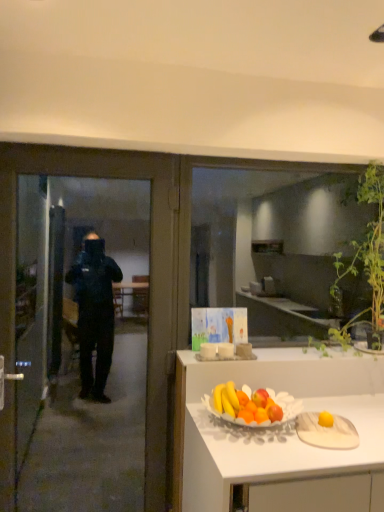
Question: Visually, is green leafy plant at upper right positioned to the left or to the right of transparent glass window at center?

Choices:
 (A) right
 (B) left

Answer: (A)

Question: From a real-world perspective, is green leafy plant at upper right physically located above or below transparent glass window at center?

Choices:
 (A) above
 (B) below

Answer: (B)

Question: Which object is positioned closest to the transparent glass window at center?

Choices:
 (A) transparent glass door at left
 (B) green leafy plant at upper right

Answer: (B)

Question: Which object is positioned closest to the green leafy plant at upper right?

Choices:
 (A) transparent glass window at center
 (B) transparent glass door at left

Answer: (B)